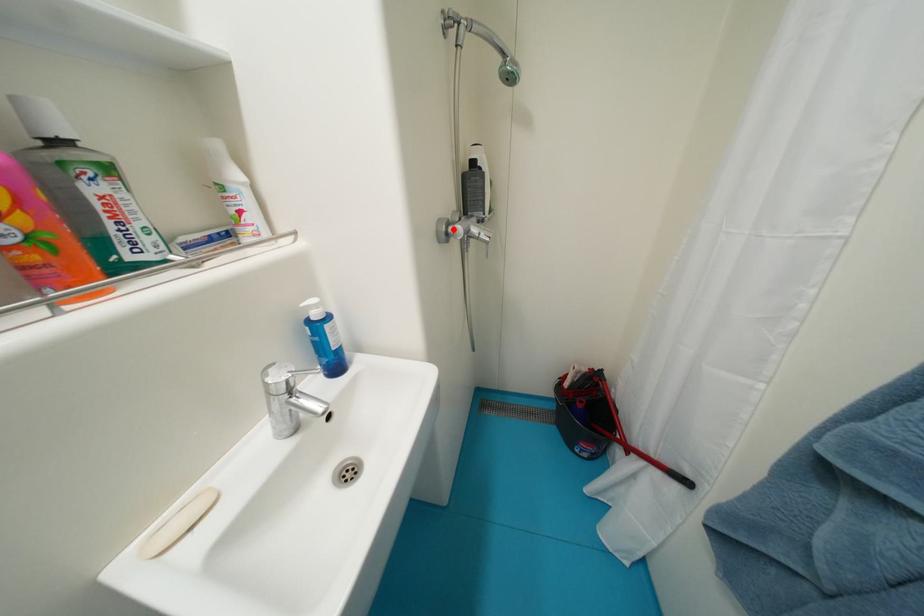
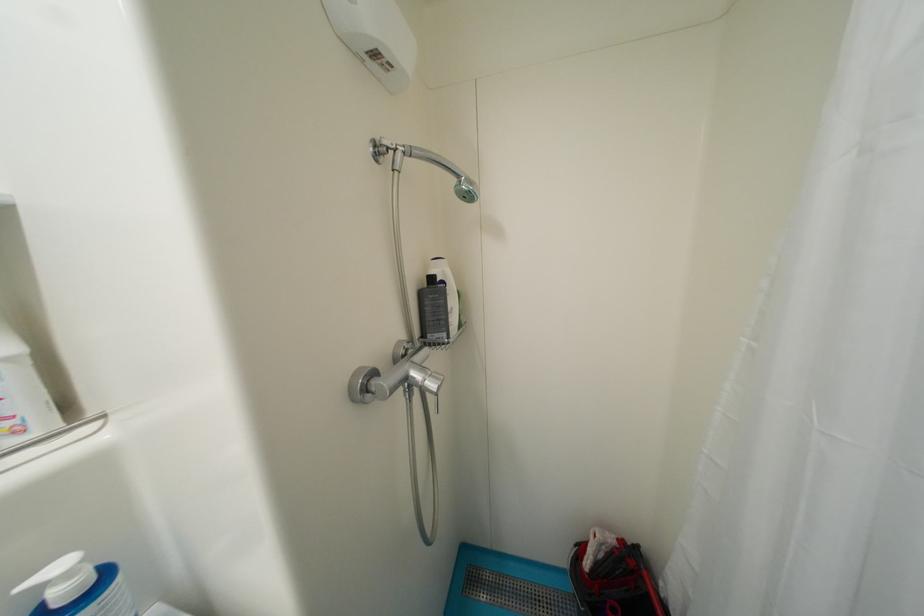
Question: I am providing you with two images of the same scene from different viewpoints. A red point is marked on the first image. At the location where the point appears in image 1, is it still visible in image 2?

Choices:
 (A) Yes
 (B) No

Answer: (A)